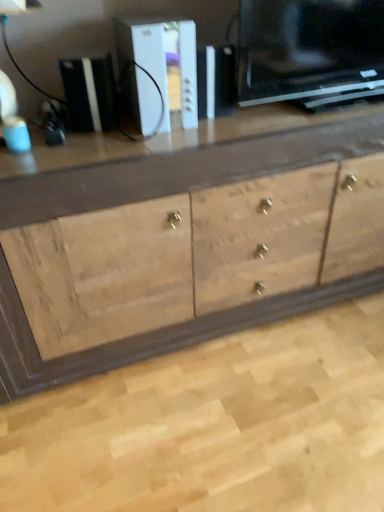
Find the location of a particular element. This screenshot has width=384, height=512. white plastic gaming console at upper center, the 1th appliance when ordered from left to right is located at coordinates (89, 92).

Where is `natural wood cabinet at center`? This screenshot has width=384, height=512. natural wood cabinet at center is located at coordinates (176, 170).

Would you say natural wood cabinet at center is part of white plastic gaming console at upper center, the 1th appliance when ordered from left to right,'s contents?

No.

In the scene shown: From the image's perspective, which one is positioned higher, white plastic gaming console at upper center, the 1th appliance when ordered from left to right, or natural wood cabinet at center?

white plastic gaming console at upper center, the 1th appliance when ordered from left to right, is shown above in the image.

Is point (76, 94) positioned behind point (8, 193)?

Yes, it is.

Which of these two, white plastic gaming console at upper center, the 1th appliance when ordered from left to right, or natural wood cabinet at center, is bigger?

With larger size is natural wood cabinet at center.

Does point (150, 32) appear closer or farther from the camera than point (58, 361)?

Point (150, 32) appears to be closer to the viewer than point (58, 361).

Does white plastic console at center, which is counted as the 1th appliance, starting from the right, lie behind natural wood cabinet at center?

Yes, white plastic console at center, which is counted as the 1th appliance, starting from the right, is further from the camera.

What are the coordinates of `chest of drawers in front of the white plastic console at center, which is counted as the 1th appliance, starting from the right` in the screenshot? It's located at (176, 170).

From the image's perspective, between white plastic console at center, which is counted as the 1th appliance, starting from the right, and natural wood cabinet at center, which one is located above?

white plastic console at center, which is counted as the 1th appliance, starting from the right, appears higher in the image.

Is natural wood cabinet at center to the left or to the right of white plastic console at center, arranged as the second appliance when viewed from the left, in the image?

Based on their positions, natural wood cabinet at center is located to the right of white plastic console at center, arranged as the second appliance when viewed from the left.

Could you tell me if natural wood cabinet at center is turned towards white plastic console at center, which is counted as the 1th appliance, starting from the right?

No, natural wood cabinet at center is not aimed at white plastic console at center, which is counted as the 1th appliance, starting from the right.

Between natural wood cabinet at center and white plastic console at center, arranged as the second appliance when viewed from the left, which one has smaller width?

white plastic console at center, arranged as the second appliance when viewed from the left, is thinner.

Can you confirm if natural wood cabinet at center is bigger than white plastic console at center, which is counted as the 1th appliance, starting from the right?

Yes.

How far apart are natural wood cabinet at center and white plastic gaming console at upper center, the 1th appliance when ordered from left to right?

natural wood cabinet at center and white plastic gaming console at upper center, the 1th appliance when ordered from left to right, are 43.86 centimeters apart.

Is natural wood cabinet at center looking in the opposite direction of white plastic gaming console at upper center, the 1th appliance when ordered from left to right?

No, white plastic gaming console at upper center, the 1th appliance when ordered from left to right, is not at the back of natural wood cabinet at center.

Between natural wood cabinet at center and white plastic gaming console at upper center, the 1th appliance when ordered from left to right, which one has more height?

natural wood cabinet at center.

From the image's perspective, which is above, natural wood cabinet at center or white plastic gaming console at upper center, the second appliance when ordered from right to left?

white plastic gaming console at upper center, the second appliance when ordered from right to left, is shown above in the image.

Is white plastic gaming console at upper center, the 1th appliance when ordered from left to right, oriented towards white plastic console at center, which is counted as the 1th appliance, starting from the right?

No, white plastic gaming console at upper center, the 1th appliance when ordered from left to right, is not aimed at white plastic console at center, which is counted as the 1th appliance, starting from the right.

From a real-world perspective, which object rests below the other?

white plastic gaming console at upper center, the second appliance when ordered from right to left.

In the image, there is a white plastic gaming console at upper center, the 1th appliance when ordered from left to right. At what (x,y) coordinates should I click in order to perform the action: click on appliance above it (from the image's perspective). Please return your answer as a coordinate pair (x, y). Looking at the image, I should click on (158, 68).

Does white plastic gaming console at upper center, the 1th appliance when ordered from left to right, lie in front of white plastic console at center, arranged as the second appliance when viewed from the left?

No, white plastic gaming console at upper center, the 1th appliance when ordered from left to right, is further to the viewer.

Is white plastic console at center, which is counted as the 1th appliance, starting from the right, far away from white plastic gaming console at upper center, the second appliance when ordered from right to left?

No, white plastic console at center, which is counted as the 1th appliance, starting from the right, is in close proximity to white plastic gaming console at upper center, the second appliance when ordered from right to left.

What's the angular difference between white plastic console at center, which is counted as the 1th appliance, starting from the right, and white plastic gaming console at upper center, the second appliance when ordered from right to left,'s facing directions?

There is a 25.3-degree angle between the facing directions of white plastic console at center, which is counted as the 1th appliance, starting from the right, and white plastic gaming console at upper center, the second appliance when ordered from right to left.

From a real-world perspective, which is physically above, white plastic console at center, arranged as the second appliance when viewed from the left, or white plastic gaming console at upper center, the 1th appliance when ordered from left to right?

white plastic console at center, arranged as the second appliance when viewed from the left, from a real-world perspective.

How far apart are white plastic console at center, arranged as the second appliance when viewed from the left, and white plastic gaming console at upper center, the 1th appliance when ordered from left to right?

white plastic console at center, arranged as the second appliance when viewed from the left, is 5.66 inches from white plastic gaming console at upper center, the 1th appliance when ordered from left to right.

I want to click on the chest of drawers lying in front of the white plastic gaming console at upper center, the second appliance when ordered from right to left, so click(176, 170).

At what (x,y) coordinates should I click in order to perform the action: click on the chest of drawers that is below the white plastic console at center, which is counted as the 1th appliance, starting from the right (from the image's perspective). Please return your answer as a coordinate pair (x, y). Looking at the image, I should click on (176, 170).

Which object lies nearer to the anchor point white plastic console at center, which is counted as the 1th appliance, starting from the right, natural wood cabinet at center or white plastic gaming console at upper center, the 1th appliance when ordered from left to right?

white plastic gaming console at upper center, the 1th appliance when ordered from left to right.

Which object lies nearer to the anchor point white plastic gaming console at upper center, the second appliance when ordered from right to left, natural wood cabinet at center or white plastic console at center, which is counted as the 1th appliance, starting from the right?

white plastic console at center, which is counted as the 1th appliance, starting from the right.

Considering their positions, is white plastic console at center, which is counted as the 1th appliance, starting from the right, positioned further to white plastic gaming console at upper center, the second appliance when ordered from right to left, than natural wood cabinet at center?

The object further to white plastic gaming console at upper center, the second appliance when ordered from right to left, is natural wood cabinet at center.

From the image, which object appears to be nearer to white plastic console at center, arranged as the second appliance when viewed from the left, white plastic gaming console at upper center, the 1th appliance when ordered from left to right, or natural wood cabinet at center?

white plastic gaming console at upper center, the 1th appliance when ordered from left to right.

When comparing their distances from natural wood cabinet at center, does white plastic gaming console at upper center, the second appliance when ordered from right to left, or white plastic console at center, which is counted as the 1th appliance, starting from the right, seem further?

The object further to natural wood cabinet at center is white plastic gaming console at upper center, the second appliance when ordered from right to left.

Looking at the image, which one is located closer to natural wood cabinet at center, white plastic console at center, arranged as the second appliance when viewed from the left, or white plastic gaming console at upper center, the second appliance when ordered from right to left?

white plastic console at center, arranged as the second appliance when viewed from the left.

At what (x,y) coordinates should I click in order to perform the action: click on appliance between white plastic gaming console at upper center, the second appliance when ordered from right to left, and natural wood cabinet at center from left to right. Please return your answer as a coordinate pair (x, y). This screenshot has height=512, width=384. Looking at the image, I should click on (158, 68).